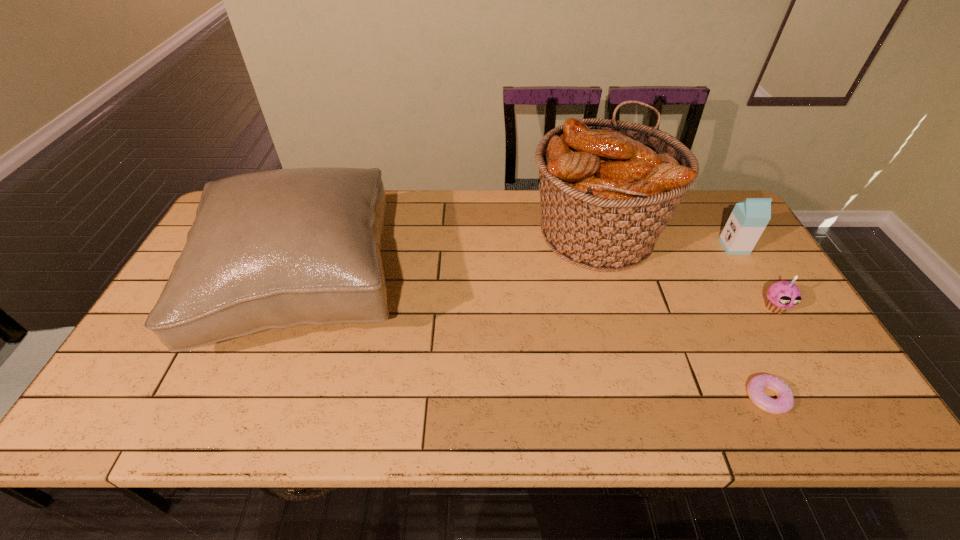
Locate an element on the screen. vacant space located on the back of the nearest object is located at coordinates (704, 272).

This screenshot has width=960, height=540. Identify the location of basket positioned at the far edge. (608, 188).

Find the location of a particular element. The height and width of the screenshot is (540, 960). cushion that is at the far edge is located at coordinates (274, 249).

Identify the location of object that is at the near edge. Image resolution: width=960 pixels, height=540 pixels. (785, 400).

The height and width of the screenshot is (540, 960). What are the coordinates of `object that is at the left edge` in the screenshot? It's located at (274, 249).

Identify the location of milk carton at the right edge. (749, 218).

Find the location of a particular element. This screenshot has height=540, width=960. cupcake present at the right edge is located at coordinates (782, 295).

Find the location of a particular element. The height and width of the screenshot is (540, 960). doughnut located in the right edge section of the desktop is located at coordinates (785, 400).

Where is `object that is at the far left corner`? object that is at the far left corner is located at coordinates (274, 249).

Identify the location of object that is at the near right corner. The image size is (960, 540). (785, 400).